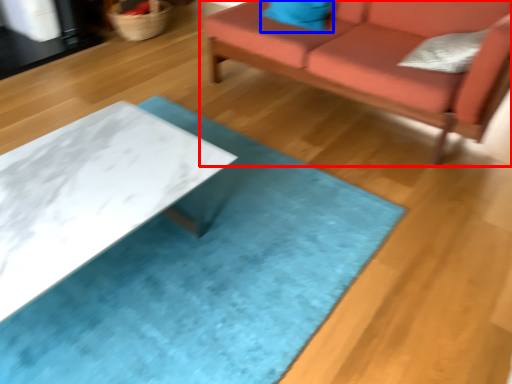
Question: Which object appears closest to the camera in this image, studio couch (highlighted by a red box) or pillow (highlighted by a blue box)?

Choices:
 (A) studio couch
 (B) pillow

Answer: (A)